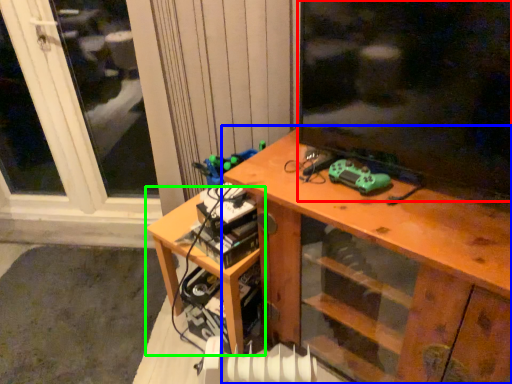
Question: Estimate the real-world distances between objects in this image. Which object is farther from window screen (highlighted by a red box), desk (highlighted by a blue box) or table (highlighted by a green box)?

Choices:
 (A) desk
 (B) table

Answer: (B)